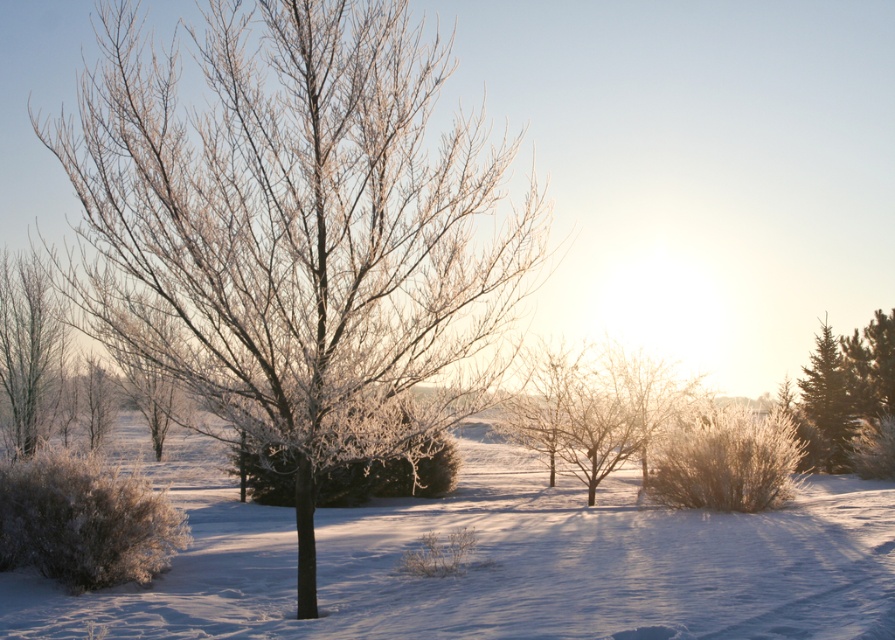
Is the position of white fluffy snow at center more distant than that of frosted white tree at left?

No.

Does white fluffy snow at center appear over frosted white tree at left?

Incorrect, white fluffy snow at center is not positioned above frosted white tree at left.

Image resolution: width=895 pixels, height=640 pixels. What are the coordinates of `white fluffy snow at center` in the screenshot? It's located at (490, 561).

Is frosted bark tree at center behind white fluffy snow at center?

Yes, it is behind white fluffy snow at center.

Consider the image. Is frosted bark tree at center smaller than white fluffy snow at center?

No.

Is point (248, 346) positioned behind point (352, 508)?

That is False.

Locate an element on the screen. The image size is (895, 640). frosted bark tree at center is located at coordinates (296, 230).

Image resolution: width=895 pixels, height=640 pixels. What do you see at coordinates (296, 230) in the screenshot? I see `frosted bark tree at center` at bounding box center [296, 230].

Who is more forward, (324, 147) or (32, 342)?

Positioned in front is point (324, 147).

Who is more forward, (390, 420) or (53, 390)?

Positioned in front is point (390, 420).

The image size is (895, 640). I want to click on frosted bark tree at center, so click(296, 230).